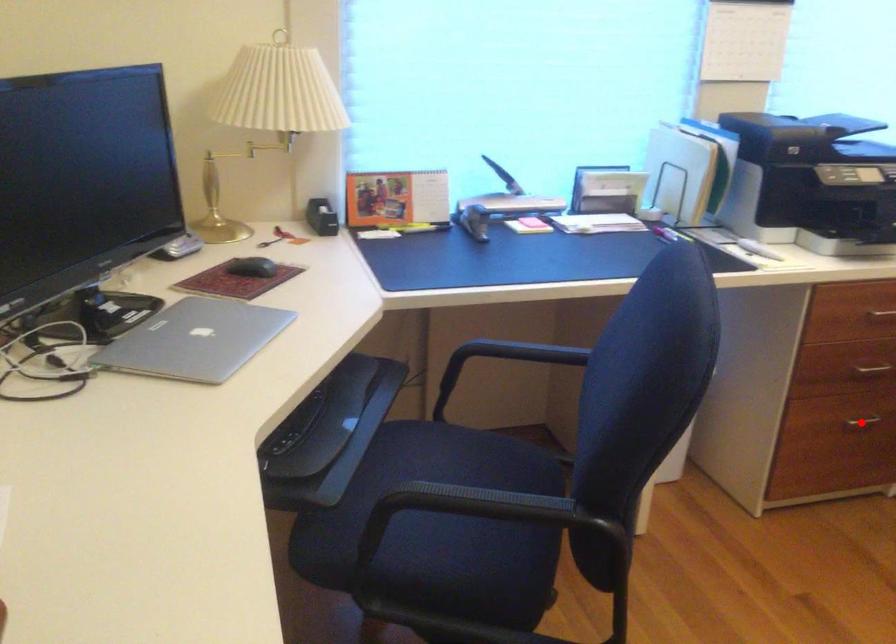
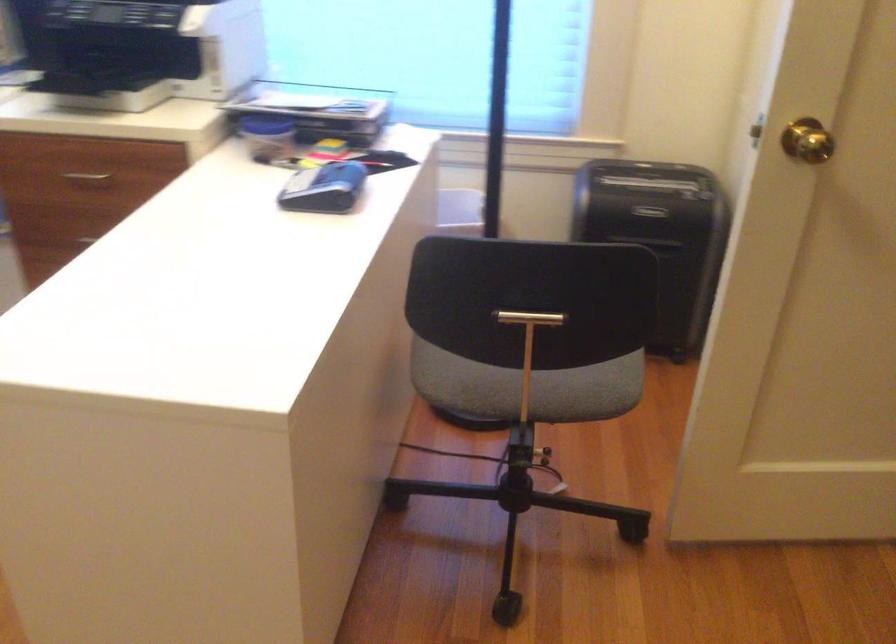
Question: I am providing you with two images of the same scene from different viewpoints. A red point is marked on the first image. At the location where the point appears in image 1, is it still visible in image 2?

Choices:
 (A) Yes
 (B) No

Answer: (B)